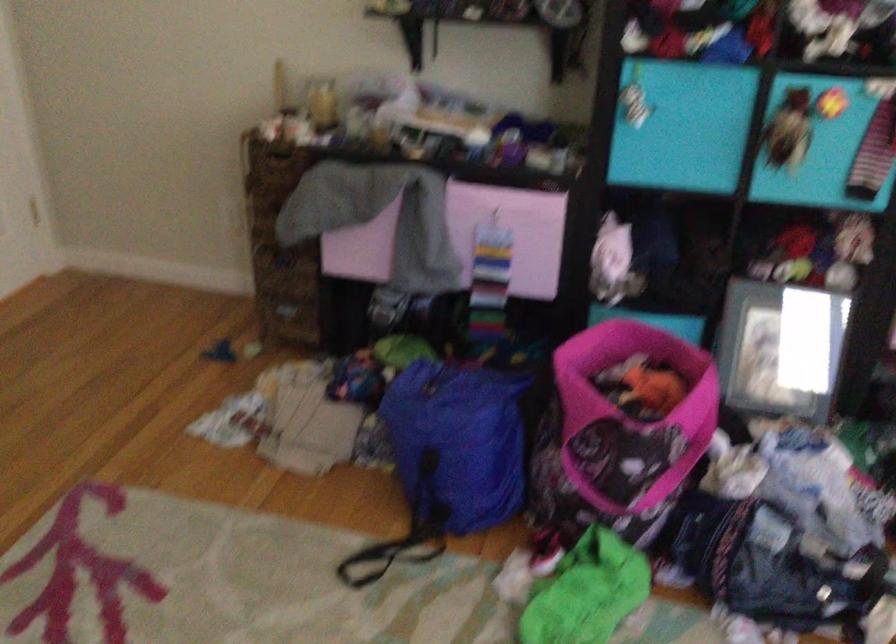
Question: The camera is either moving clockwise (left) or counter-clockwise (right) around the object. The first image is from the beginning of the video and the second image is from the end. Is the camera moving left or right when shooting the video?

Choices:
 (A) Left
 (B) Right

Answer: (A)